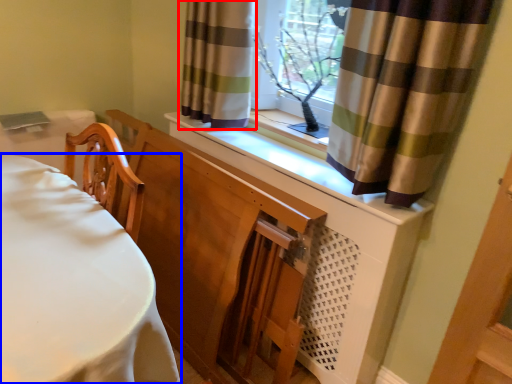
Question: Which point is further to the camera, curtain (highlighted by a red box) or furniture (highlighted by a blue box)?

Choices:
 (A) curtain
 (B) furniture

Answer: (A)